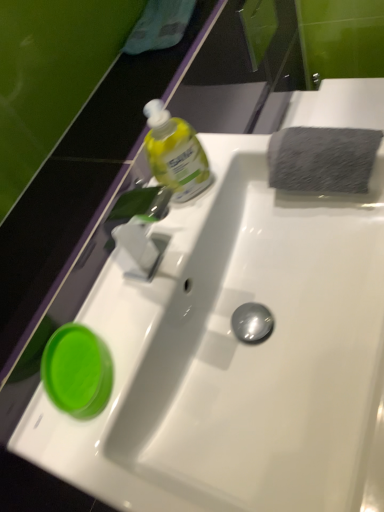
Question: Does translucent yellow liquid at upper center appear on the right side of green glossy cup at lower left?

Choices:
 (A) no
 (B) yes

Answer: (B)

Question: From the image's perspective, is translucent yellow liquid at upper center located beneath green glossy cup at lower left?

Choices:
 (A) yes
 (B) no

Answer: (B)

Question: Is translucent yellow liquid at upper center positioned far away from green glossy cup at lower left?

Choices:
 (A) no
 (B) yes

Answer: (A)

Question: Is translucent yellow liquid at upper center wider than green glossy cup at lower left?

Choices:
 (A) yes
 (B) no

Answer: (B)

Question: Could you tell me if translucent yellow liquid at upper center is facing green glossy cup at lower left?

Choices:
 (A) no
 (B) yes

Answer: (A)

Question: Considering the relative sizes of translucent yellow liquid at upper center and green glossy cup at lower left in the image provided, is translucent yellow liquid at upper center taller than green glossy cup at lower left?

Choices:
 (A) no
 (B) yes

Answer: (B)

Question: Is gray textured sponge at upper right in contact with white glossy sink at center?

Choices:
 (A) no
 (B) yes

Answer: (A)

Question: Could you tell me if gray textured sponge at upper right is facing white glossy sink at center?

Choices:
 (A) no
 (B) yes

Answer: (B)

Question: Can you confirm if gray textured sponge at upper right is thinner than white glossy sink at center?

Choices:
 (A) yes
 (B) no

Answer: (A)

Question: Does gray textured sponge at upper right have a smaller size compared to white glossy sink at center?

Choices:
 (A) no
 (B) yes

Answer: (B)

Question: Is the depth of gray textured sponge at upper right greater than that of white glossy sink at center?

Choices:
 (A) no
 (B) yes

Answer: (B)

Question: Is gray textured sponge at upper right taller than white glossy sink at center?

Choices:
 (A) yes
 (B) no

Answer: (A)

Question: From the image's perspective, would you say translucent yellow liquid at upper center is positioned over white glossy sink at center?

Choices:
 (A) no
 (B) yes

Answer: (B)